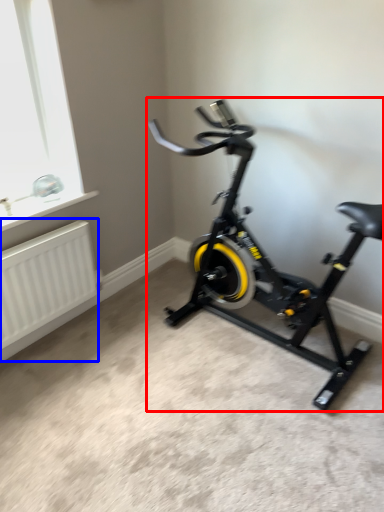
Question: Which object is closer to the camera taking this photo, stationary bicycle (highlighted by a red box) or radiator (highlighted by a blue box)?

Choices:
 (A) stationary bicycle
 (B) radiator

Answer: (A)